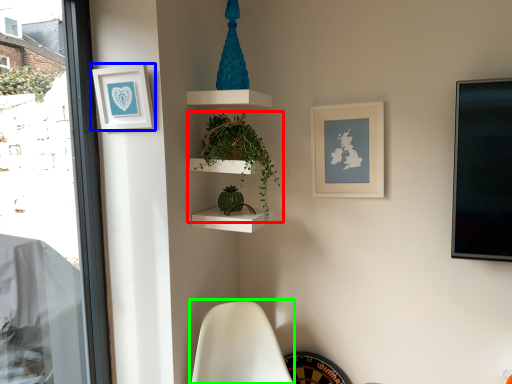
Question: Considering the real-world distances, which object is closest to houseplant (highlighted by a red box)? picture frame (highlighted by a blue box) or swivel chair (highlighted by a green box).

Choices:
 (A) picture frame
 (B) swivel chair

Answer: (A)